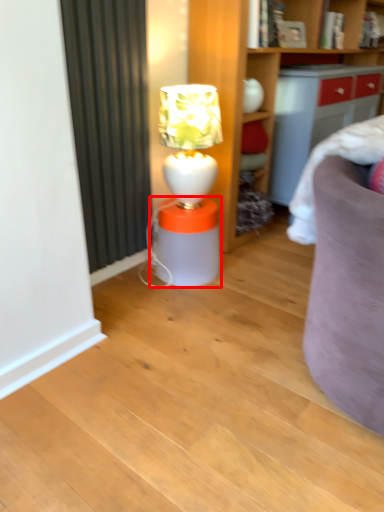
Question: From the image's perspective, where is table (annotated by the red box) located relative to table lamp?

Choices:
 (A) below
 (B) above

Answer: (A)